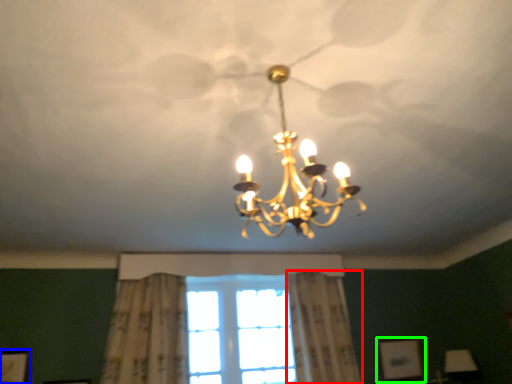
Question: Estimate the real-world distances between objects in this image. Which object is farther from curtain (highlighted by a red box), picture frame (highlighted by a blue box) or picture frame (highlighted by a green box)?

Choices:
 (A) picture frame
 (B) picture frame

Answer: (A)